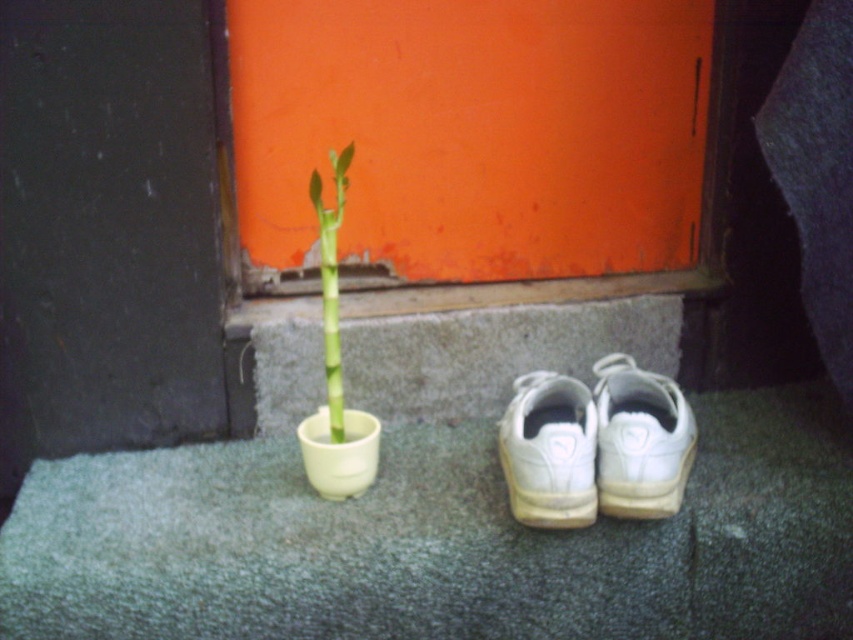
Is the position of white leather shoe at center more distant than that of white leather sneakers at lower center?

Yes, white leather shoe at center is further from the viewer.

Who is shorter, white leather shoe at center or white leather sneakers at lower center?

white leather sneakers at lower center

Is point (680, 499) behind point (572, 397)?

That is False.

Where is `white leather shoe at center`? This screenshot has width=853, height=640. white leather shoe at center is located at coordinates (640, 440).

Can you confirm if white leather sneakers at lower center is positioned to the left of green glossy bamboo at center?

In fact, white leather sneakers at lower center is to the right of green glossy bamboo at center.

Can you confirm if white leather sneakers at lower center is positioned above green glossy bamboo at center?

No, white leather sneakers at lower center is not above green glossy bamboo at center.

Find the location of a particular element. The width and height of the screenshot is (853, 640). white leather sneakers at lower center is located at coordinates (549, 451).

Between white leather shoe at center and green glossy bamboo at center, which one appears on the left side from the viewer's perspective?

From the viewer's perspective, green glossy bamboo at center appears more on the left side.

From the picture: Between white leather shoe at center and green glossy bamboo at center, which one is positioned higher?

green glossy bamboo at center

I want to click on white leather shoe at center, so click(640, 440).